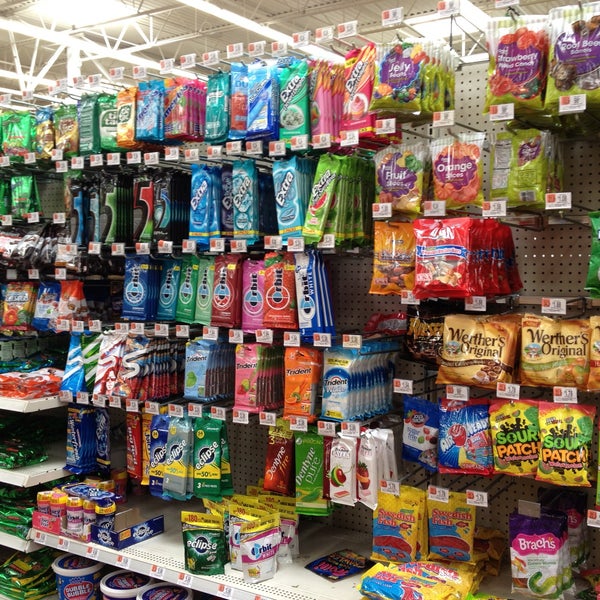
The height and width of the screenshot is (600, 600). I want to click on ceiling, so click(x=179, y=17).